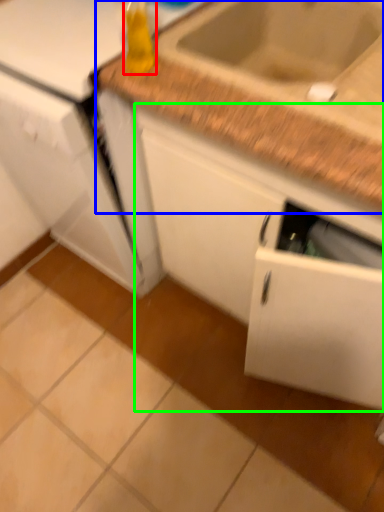
Question: Which is farther away from bottle (highlighted by a red box)? countertop (highlighted by a blue box) or cabinetry (highlighted by a green box)?

Choices:
 (A) countertop
 (B) cabinetry

Answer: (B)